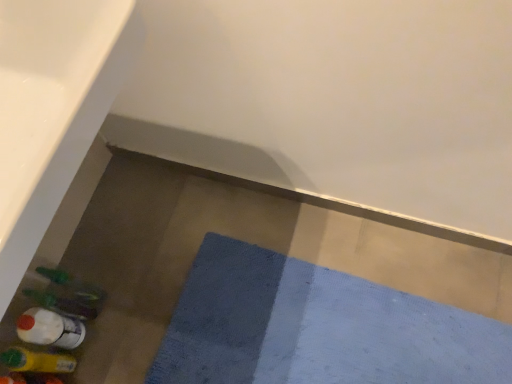
Locate an element on the screen. free space in front of translucent plastic bottle at lower left, the 3th bottle positioned from the bottom is located at coordinates (109, 354).